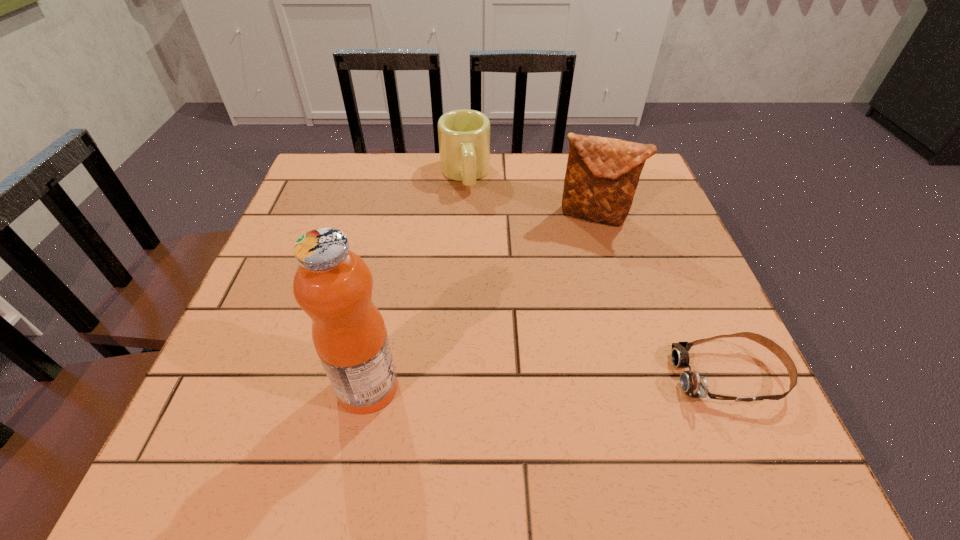
In the image, there is a desktop. What are the coordinates of `free space at the far right corner` in the screenshot? It's located at (653, 180).

The height and width of the screenshot is (540, 960). I want to click on vacant area between the second farthest object and the goggles, so coord(661,296).

Identify the location of vacant space that's between the farthest object and the goggles. This screenshot has height=540, width=960. (597, 275).

Locate an element on the screen. empty location between the goggles and the fruit juice is located at coordinates (548, 382).

Find the location of `free spot between the leftmost object and the second object from left to right`. free spot between the leftmost object and the second object from left to right is located at coordinates (417, 281).

This screenshot has height=540, width=960. Identify the location of blank region between the clutch bag and the mug. (529, 195).

Where is `vacant space in between the third shortest object and the leftmost object`? The width and height of the screenshot is (960, 540). vacant space in between the third shortest object and the leftmost object is located at coordinates (481, 301).

Where is `vacant area that lies between the fruit juice and the goggles`? vacant area that lies between the fruit juice and the goggles is located at coordinates (548, 382).

Identify the location of unoccupied area between the second tallest object and the tallest object. The image size is (960, 540). (481, 301).

At what (x,y) coordinates should I click in order to perform the action: click on empty location between the second farthest object and the tallest object. Please return your answer as a coordinate pair (x, y). The width and height of the screenshot is (960, 540). Looking at the image, I should click on (481, 301).